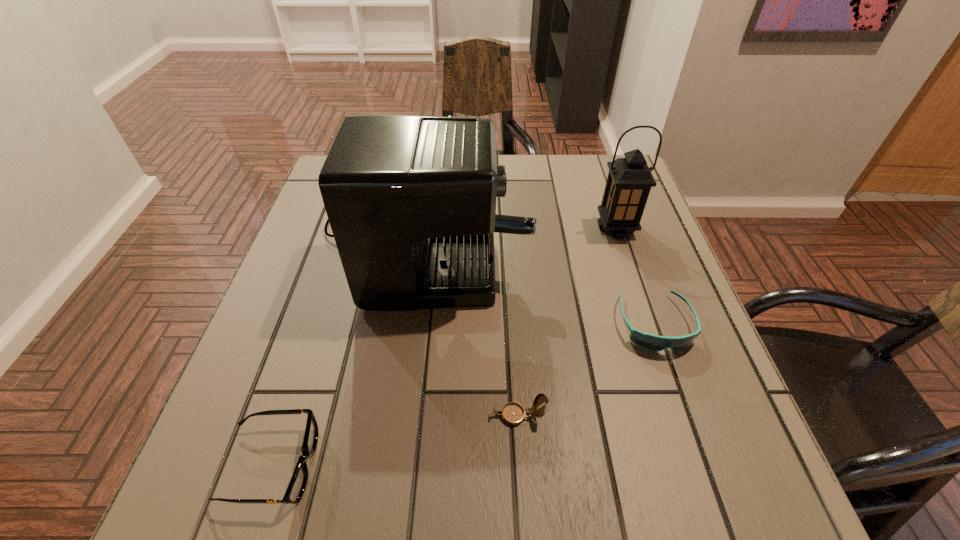
Identify the location of free space located on the face of the compass. The width and height of the screenshot is (960, 540). (454, 415).

The height and width of the screenshot is (540, 960). Identify the location of free space located 0.200m on the front-facing side of the nearer sunglasses. (444, 465).

At what (x,y) coordinates should I click in order to perform the action: click on object that is at the far edge. Please return your answer as a coordinate pair (x, y). Looking at the image, I should click on (411, 200).

The width and height of the screenshot is (960, 540). I want to click on object at the near edge, so click(x=295, y=490).

Locate an element on the screen. This screenshot has width=960, height=540. coffee maker positioned at the left edge is located at coordinates (411, 200).

Where is `sunglasses that is positioned at the left edge`? sunglasses that is positioned at the left edge is located at coordinates (295, 490).

Locate an element on the screen. Image resolution: width=960 pixels, height=540 pixels. lantern situated at the right edge is located at coordinates (629, 181).

Locate an element on the screen. This screenshot has width=960, height=540. sunglasses that is at the right edge is located at coordinates (648, 341).

Where is `object positioned at the far left corner`? The width and height of the screenshot is (960, 540). object positioned at the far left corner is located at coordinates (411, 200).

Image resolution: width=960 pixels, height=540 pixels. I want to click on object located in the near left corner section of the desktop, so click(x=295, y=490).